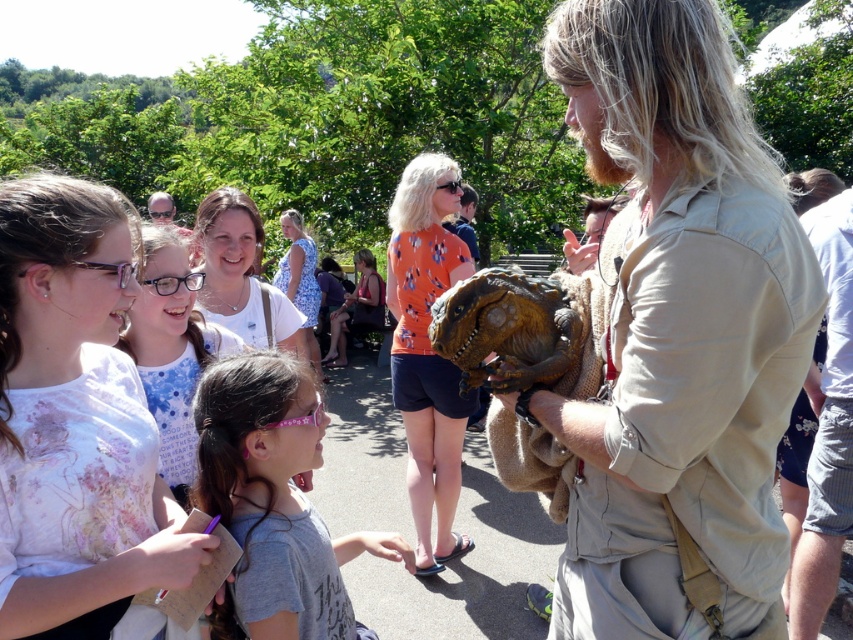
Does point (440, 502) lie behind point (178, 388)?

That is True.

Who is higher up, orange fabric dinosaur head at center or white dotted shirt at upper left?

white dotted shirt at upper left is higher up.

Find the location of a particular element. This screenshot has height=640, width=853. orange fabric dinosaur head at center is located at coordinates (427, 349).

Which is in front, point (204, 243) or point (170, 208)?

Point (204, 243) is in front.

Locate an element on the screen. The height and width of the screenshot is (640, 853). smooth skin face at center is located at coordinates (241, 275).

The width and height of the screenshot is (853, 640). I want to click on smooth skin face at center, so click(x=241, y=275).

Identify the location of smooth skin face at center. This screenshot has height=640, width=853. tap(241, 275).

Is the position of light pink floral shirt at upper left more distant than that of brown textured dinosaur puppet at center?

No, light pink floral shirt at upper left is closer to the viewer.

Can you confirm if light pink floral shirt at upper left is wider than brown textured dinosaur puppet at center?

Indeed, light pink floral shirt at upper left has a greater width compared to brown textured dinosaur puppet at center.

Who is more distant from viewer, [93,584] or [469,248]?

Positioned behind is point [469,248].

This screenshot has height=640, width=853. Identify the location of light pink floral shirt at upper left. click(79, 406).